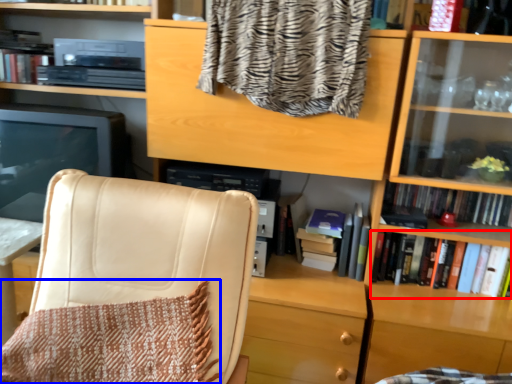
Question: Which of the following is the farthest to the observer, book (highlighted by a red box) or blanket (highlighted by a blue box)?

Choices:
 (A) book
 (B) blanket

Answer: (A)